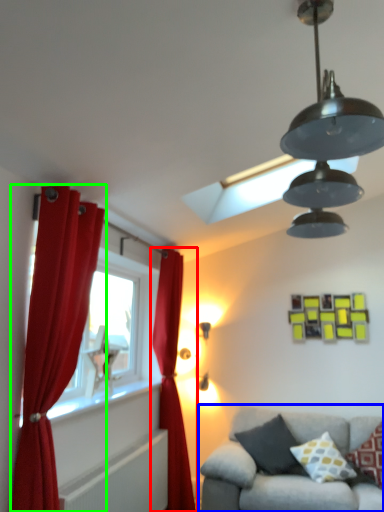
Question: Which object is the closest to the curtain (highlighted by a red box)? Choose among these: studio couch (highlighted by a blue box) or curtain (highlighted by a green box).

Choices:
 (A) studio couch
 (B) curtain

Answer: (A)